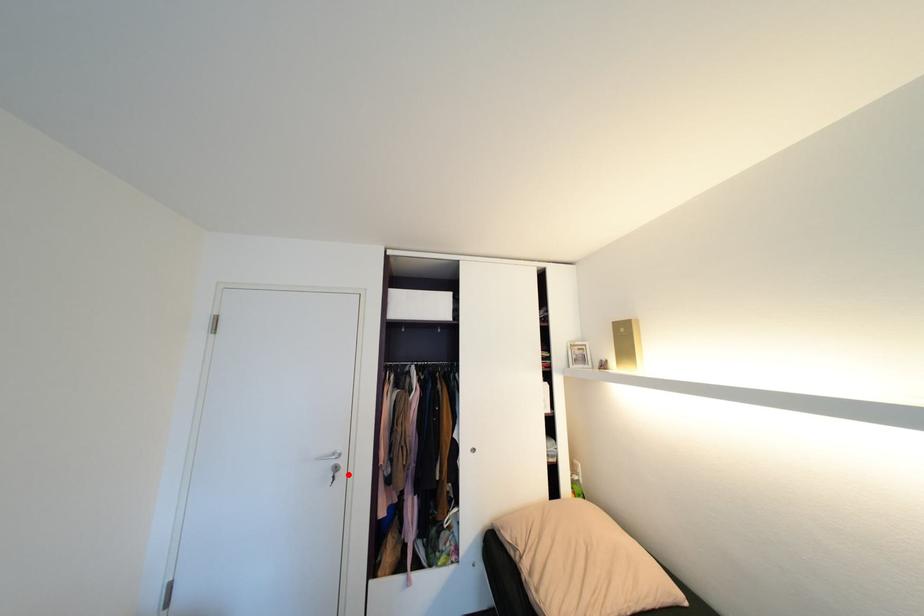
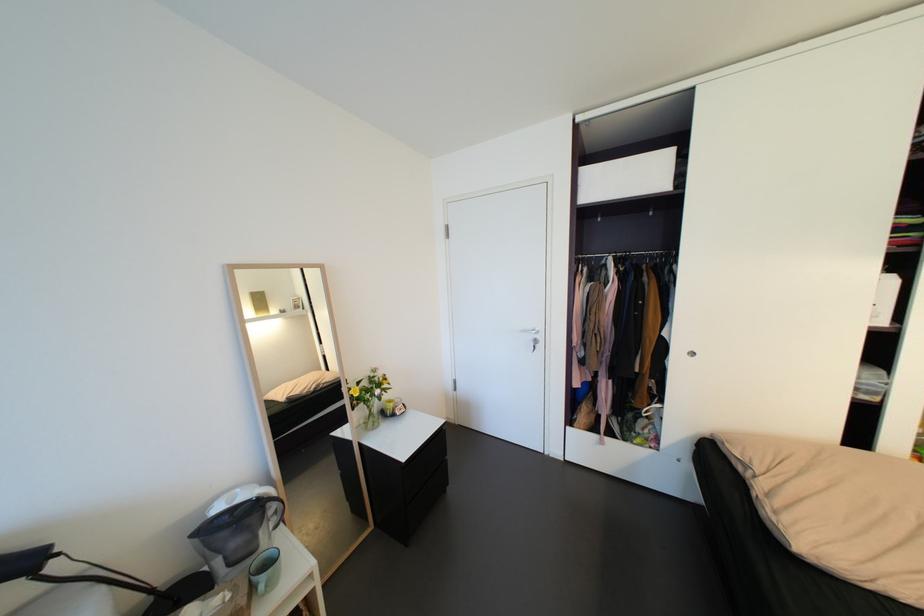
Question: I am providing you with two images of the same scene from different viewpoints. A red point is marked on the first image. Is the red point's position out of view in image 2?

Choices:
 (A) Yes
 (B) No

Answer: (B)